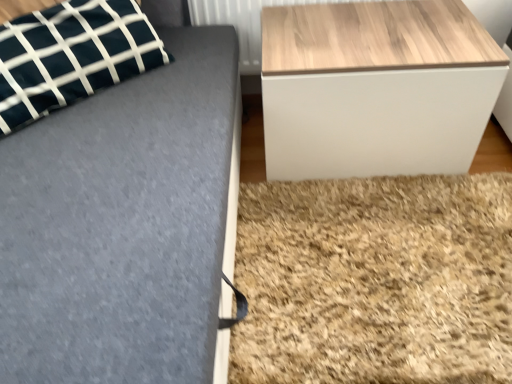
Question: Can you confirm if dark green fabric pillow at upper left is positioned to the right of wooden/textured table at right?

Choices:
 (A) no
 (B) yes

Answer: (A)

Question: From a real-world perspective, is dark green fabric pillow at upper left located beneath wooden/textured table at right?

Choices:
 (A) yes
 (B) no

Answer: (B)

Question: Considering the relative positions of dark green fabric pillow at upper left and wooden/textured table at right in the image provided, is dark green fabric pillow at upper left in front of wooden/textured table at right?

Choices:
 (A) no
 (B) yes

Answer: (B)

Question: Can you confirm if dark green fabric pillow at upper left is positioned to the left of wooden/textured table at right?

Choices:
 (A) yes
 (B) no

Answer: (A)

Question: Does dark green fabric pillow at upper left turn towards wooden/textured table at right?

Choices:
 (A) no
 (B) yes

Answer: (A)

Question: Looking at their shapes, would you say wooden radiator at upper right is wider or thinner than dark green fabric pillow at upper left?

Choices:
 (A) wide
 (B) thin

Answer: (B)

Question: From a real-world perspective, is wooden radiator at upper right above or below dark green fabric pillow at upper left?

Choices:
 (A) below
 (B) above

Answer: (A)

Question: Considering the relative positions of wooden radiator at upper right and dark green fabric pillow at upper left in the image provided, is wooden radiator at upper right to the left or to the right of dark green fabric pillow at upper left?

Choices:
 (A) right
 (B) left

Answer: (A)

Question: Is wooden radiator at upper right bigger or smaller than dark green fabric pillow at upper left?

Choices:
 (A) big
 (B) small

Answer: (B)

Question: From the image's perspective, is dark green fabric pillow at upper left above or below wooden radiator at upper right?

Choices:
 (A) below
 (B) above

Answer: (A)

Question: Looking at their shapes, would you say dark green fabric pillow at upper left is wider or thinner than wooden radiator at upper right?

Choices:
 (A) thin
 (B) wide

Answer: (B)

Question: Is dark green fabric pillow at upper left taller or shorter than wooden radiator at upper right?

Choices:
 (A) tall
 (B) short

Answer: (A)

Question: Is point (51, 72) positioned closer to the camera than point (249, 49)?

Choices:
 (A) closer
 (B) farther

Answer: (A)

Question: Is wooden/textured table at right inside or outside of dark green fabric pillow at upper left?

Choices:
 (A) outside
 (B) inside

Answer: (A)

Question: From the image's perspective, is wooden/textured table at right positioned above or below dark green fabric pillow at upper left?

Choices:
 (A) above
 (B) below

Answer: (B)